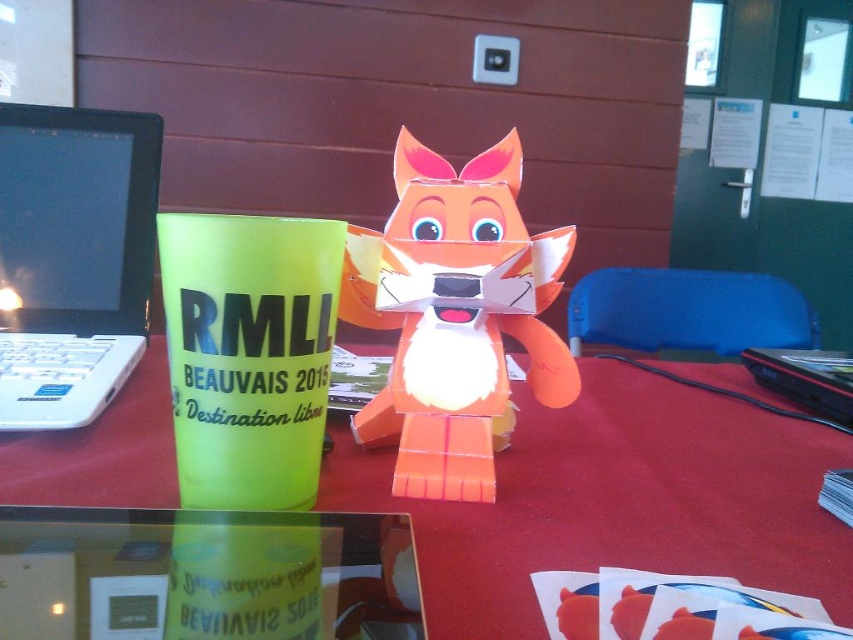
Question: Can you confirm if orange cardboard fox at center is smaller than white plastic laptop at left?

Choices:
 (A) no
 (B) yes

Answer: (B)

Question: Does orange cardboard fox at center appear over white plastic laptop at left?

Choices:
 (A) yes
 (B) no

Answer: (B)

Question: Is the position of orange cardboard fox at center less distant than that of white plastic laptop at left?

Choices:
 (A) no
 (B) yes

Answer: (B)

Question: Among these points, which one is nearest to the camera?

Choices:
 (A) (28, 262)
 (B) (791, 333)
 (C) (589, 406)

Answer: (C)

Question: Which object appears closest to the camera in this image?

Choices:
 (A) matte plastic table at center
 (B) orange cardboard fox at center
 (C) blue plastic chair at center

Answer: (A)

Question: Among these points, which one is farthest from the camera?

Choices:
 (A) (109, 212)
 (B) (392, 422)

Answer: (A)